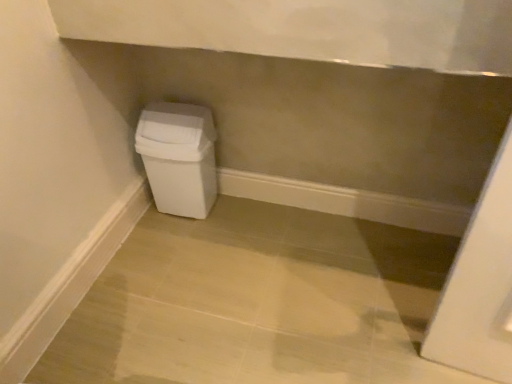
Image resolution: width=512 pixels, height=384 pixels. I want to click on white plastic waste bin at lower left, so click(179, 157).

What is the approximate width of white plastic waste bin at lower left?

The width of white plastic waste bin at lower left is 6.74 inches.

Describe the element at coordinates (179, 157) in the screenshot. I see `white plastic waste bin at lower left` at that location.

This screenshot has height=384, width=512. I want to click on white plastic waste bin at lower left, so (x=179, y=157).